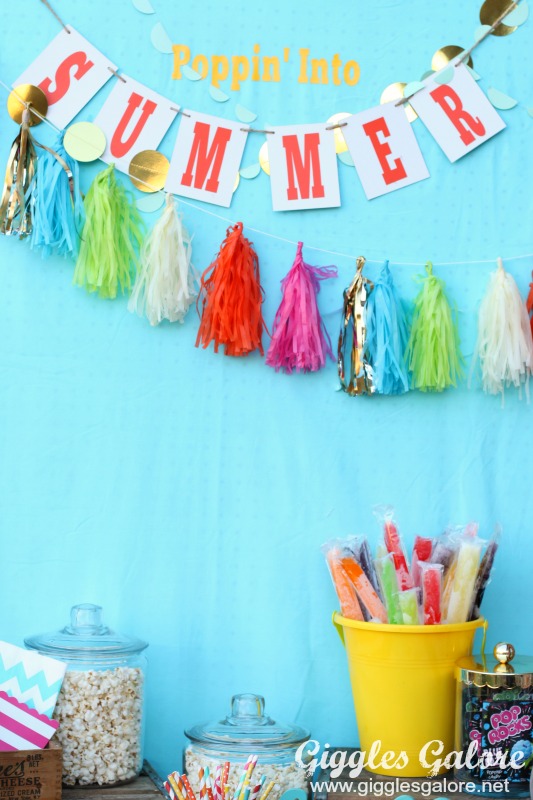
At what (x,y) coordinates should I click in order to perform the action: click on yellow plastic bucket. Please return your answer as a coordinate pair (x, y). Looking at the image, I should click on (403, 692).